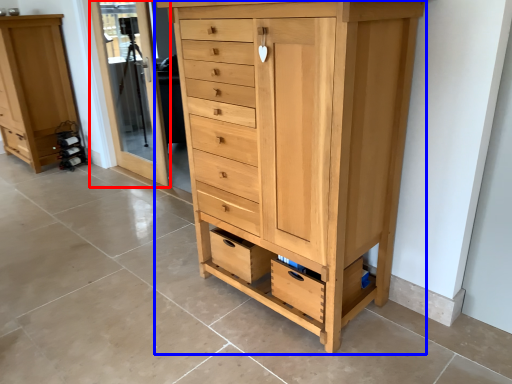
Question: Among these objects, which one is nearest to the camera, screen door (highlighted by a red box) or chest of drawers (highlighted by a blue box)?

Choices:
 (A) screen door
 (B) chest of drawers

Answer: (B)